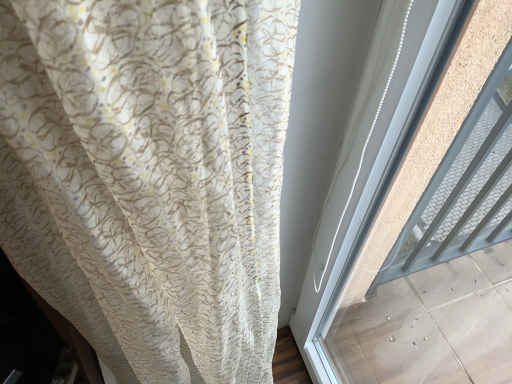
Describe the element at coordinates (367, 168) in the screenshot. The height and width of the screenshot is (384, 512). I see `transparent glass window at right` at that location.

The width and height of the screenshot is (512, 384). In order to click on transparent glass window at right in this screenshot , I will do `click(367, 168)`.

In order to face transparent glass window at right, should I rotate leftwards or rightwards?

Turn right approximately 17.518 degrees to face it.

What is the approximate width of transparent glass window at right?

transparent glass window at right is 6.08 centimeters wide.

I want to click on transparent glass window at right, so click(367, 168).